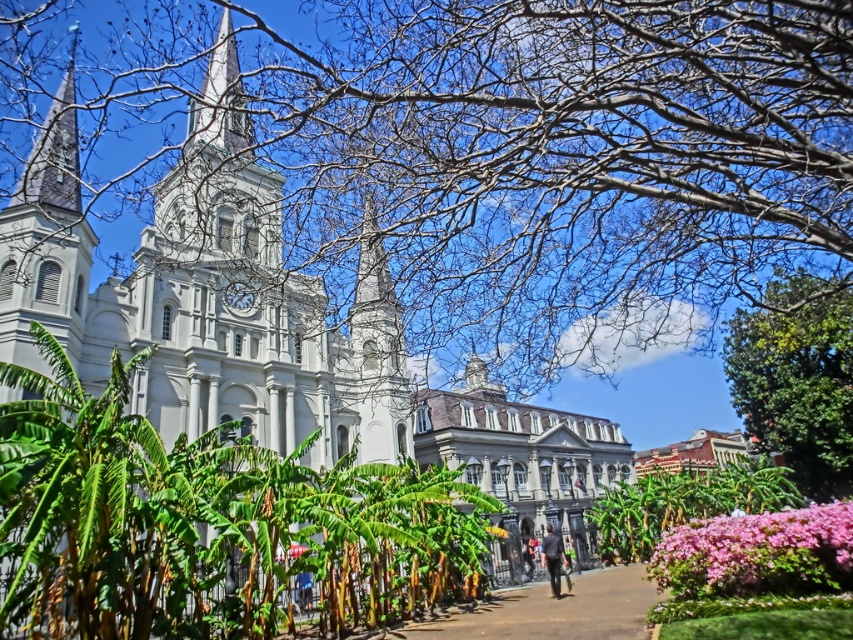
Consider the image. You are a bird looking for a place to perch. You see the bare branches at upper center and the white stone building at center. Which location offers a higher vantage point?

The bare branches at upper center are positioned over the white stone building at center, so they provide a higher vantage point for perching.

You are a drone operator trying to capture a photo of the historic church with its twin spires. Your drone is currently positioned at point 0.25, 0.65. The scene includes bare branches at upper center. Will your drone be able to take a clear photo of the church without the bare branches blocking the view?

The bare branches at upper center are located at point (561, 157), which is very close to the drone position at (554, 160). This proximity means the branches may obstruct the view of the church, so the photo might not be clear.